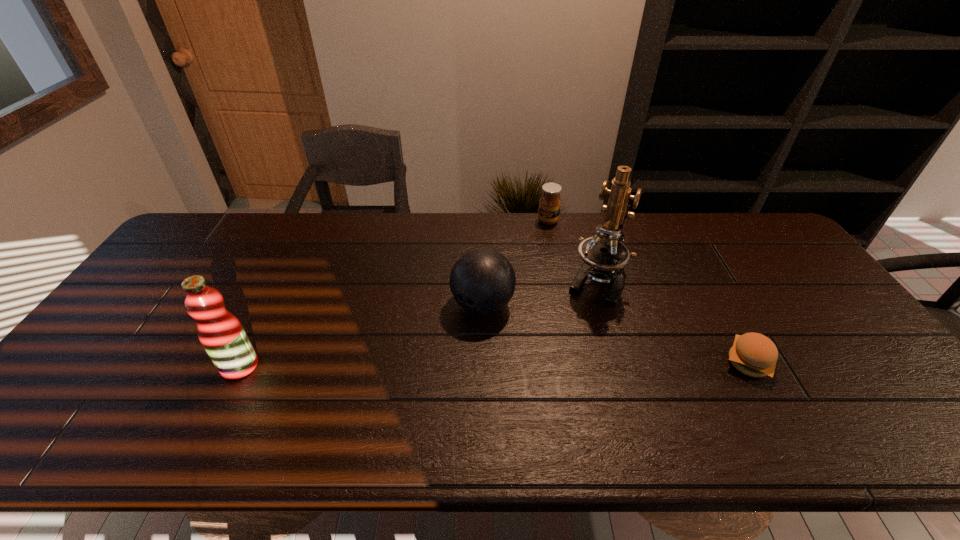
Find the location of a particular element. Image resolution: width=960 pixels, height=540 pixels. blank area located on the front label of the second tallest object is located at coordinates (132, 366).

The width and height of the screenshot is (960, 540). Identify the location of vacant space situated on the front label of the second tallest object. (84, 366).

Find the location of a particular element. The image size is (960, 540). vacant space located on the left of the shortest object is located at coordinates (634, 363).

I want to click on vacant area situated at the eyepiece of the microscope, so click(x=575, y=330).

Identify the location of vacant space located at the eyepiece of the microscope. Image resolution: width=960 pixels, height=540 pixels. (551, 380).

Image resolution: width=960 pixels, height=540 pixels. Find the location of `vacant point located at the eyepiece of the microscope`. vacant point located at the eyepiece of the microscope is located at coordinates (556, 371).

At what (x,y) coordinates should I click in order to perform the action: click on free space located on the front-facing side of the farthest object. Please return your answer as a coordinate pair (x, y). This screenshot has height=540, width=960. Looking at the image, I should click on (522, 289).

Find the location of `blank area located 0.340m on the front-facing side of the farthest object`. blank area located 0.340m on the front-facing side of the farthest object is located at coordinates (522, 291).

I want to click on vacant position located 0.300m on the front-facing side of the farthest object, so click(525, 282).

Where is `vacant space situated on the grip area of the bowling ball`? vacant space situated on the grip area of the bowling ball is located at coordinates coord(450,342).